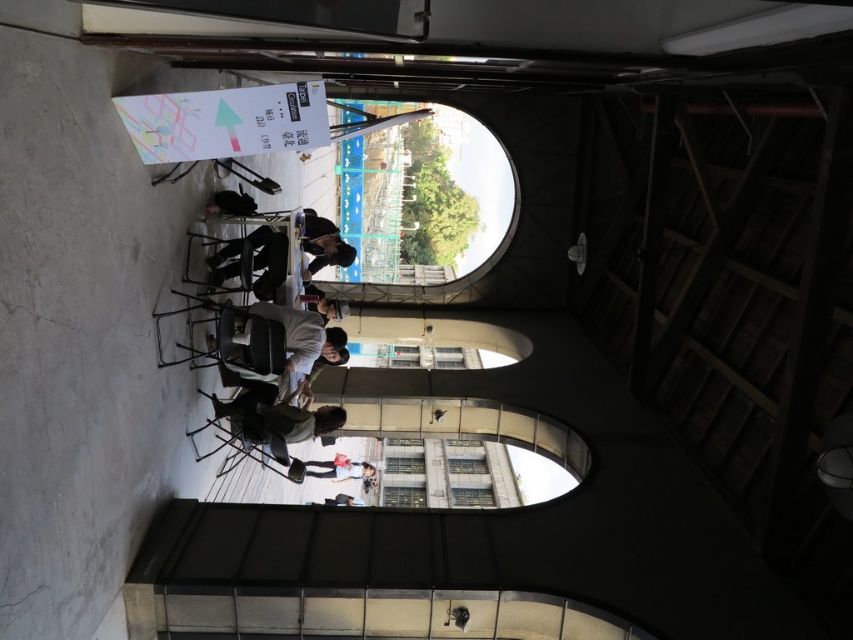
Who is shorter, green fabric shirt at lower center or light pink fabric at center?

green fabric shirt at lower center

Which is behind, point (270, 422) or point (341, 465)?

Positioned behind is point (341, 465).

This screenshot has width=853, height=640. Identify the location of green fabric shirt at lower center. (277, 419).